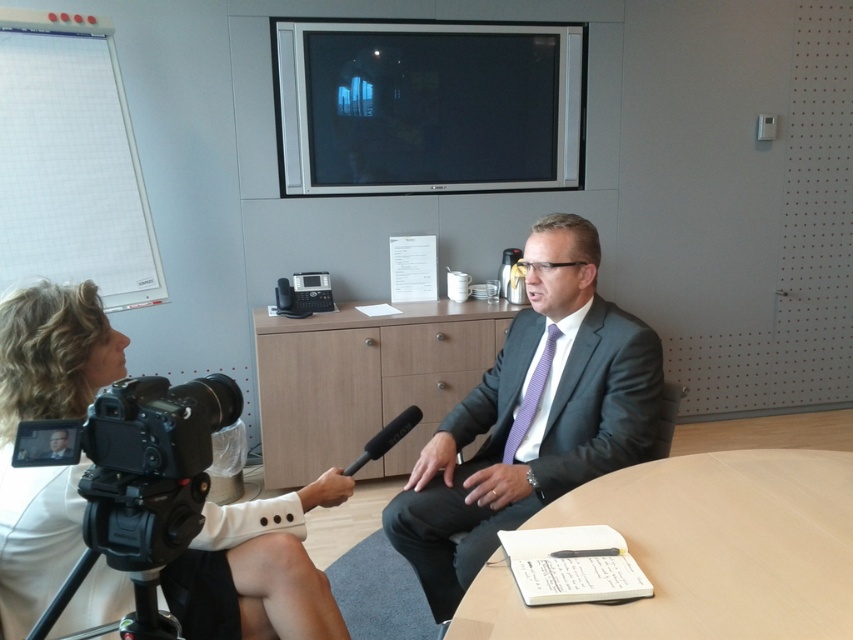
You are a camera operator in the room. You need to adjust the camera angle to focus on the purple striped tie at center without moving the black plastic tripod at lower left. Is this possible?

The black plastic tripod at lower left is below the purple striped tie at center, so adjusting the camera angle upwards while keeping the tripod stationary would allow focusing on the tie.

You are a camera operator in the room. You need to adjust the camera to focus on the dark gray suit at center and the wooden table at center. Based on their positions, which object should you prioritize framing first in the camera viewfinder?

The dark gray suit at center is in front of the wooden table at center, so you should prioritize framing the dark gray suit at center first since it is closer to the camera and will be the primary focus.

You are a technician setting up a conference room. You have a new projector that needs to be placed at point 0.6, 0.4. Can you place it near the wooden table at center?

The wooden table at center is located at point (x=364, y=380), which is very close to the desired point (x=340, y=384). Yes, you can place the projector near the wooden table at center.